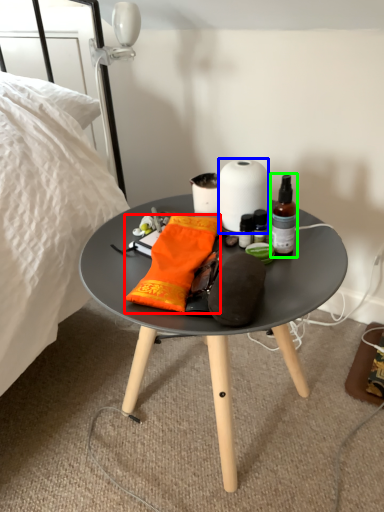
Question: Based on their relative distances, which object is nearer to material (highlighted by a red box)? Choose from paper towel (highlighted by a blue box) and bottle (highlighted by a green box).

Choices:
 (A) paper towel
 (B) bottle

Answer: (A)